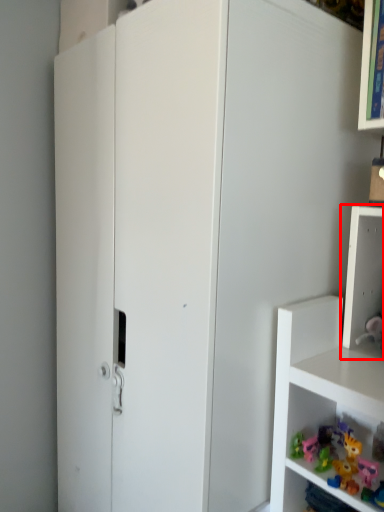
Question: Where is shelf (annotated by the red box) located in relation to toy in the image?

Choices:
 (A) left
 (B) right

Answer: (B)